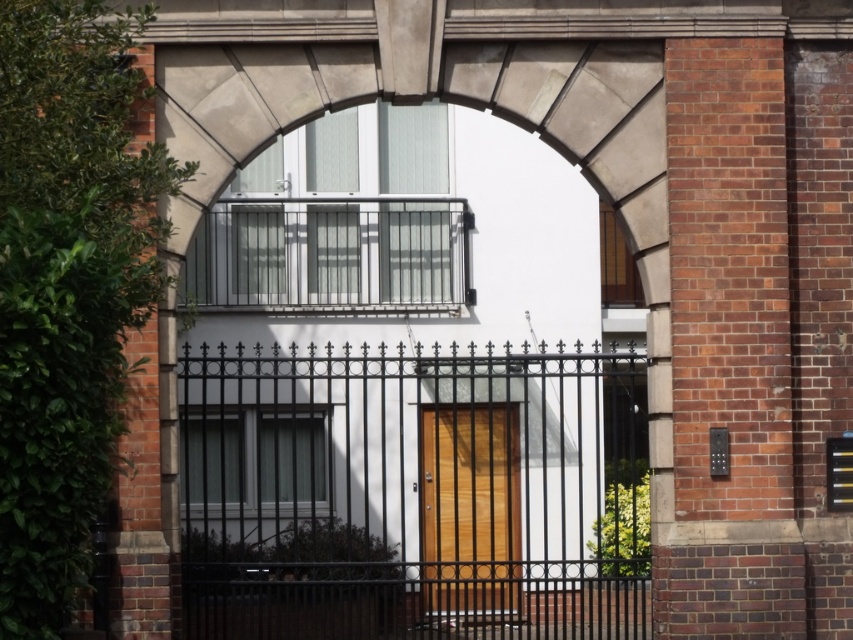
This screenshot has width=853, height=640. I want to click on metallic silver balcony at upper center, so click(x=329, y=253).

Is point (189, 291) less distant than point (469, 520)?

Yes, it is.

Is point (254, 227) behind point (437, 614)?

Yes, point (254, 227) is behind point (437, 614).

Identify the location of metallic silver balcony at upper center. This screenshot has width=853, height=640. (329, 253).

Is black wrought iron gate at center bigger than metallic silver balcony at upper center?

Yes, black wrought iron gate at center is bigger than metallic silver balcony at upper center.

Does black wrought iron gate at center have a greater height compared to metallic silver balcony at upper center?

Indeed, black wrought iron gate at center has a greater height compared to metallic silver balcony at upper center.

What do you see at coordinates (413, 492) in the screenshot?
I see `black wrought iron gate at center` at bounding box center [413, 492].

Image resolution: width=853 pixels, height=640 pixels. I want to click on black wrought iron gate at center, so click(x=413, y=492).

Is the position of black wrought iron gate at center more distant than that of wooden door at center?

That is False.

Can you confirm if black wrought iron gate at center is positioned above wooden door at center?

Yes.

What are the coordinates of `black wrought iron gate at center` in the screenshot? It's located at (413, 492).